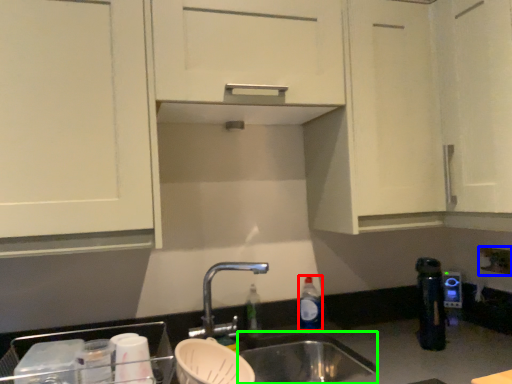
Question: Which object is positioned farthest from bottle (highlighted by a red box)? Select from electric outlet (highlighted by a blue box) and sink (highlighted by a green box).

Choices:
 (A) electric outlet
 (B) sink

Answer: (A)